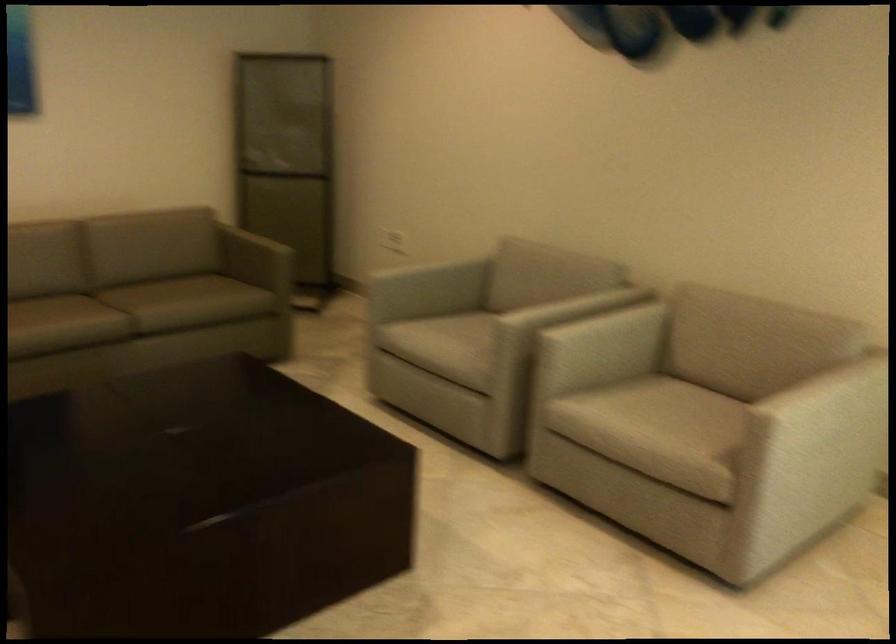
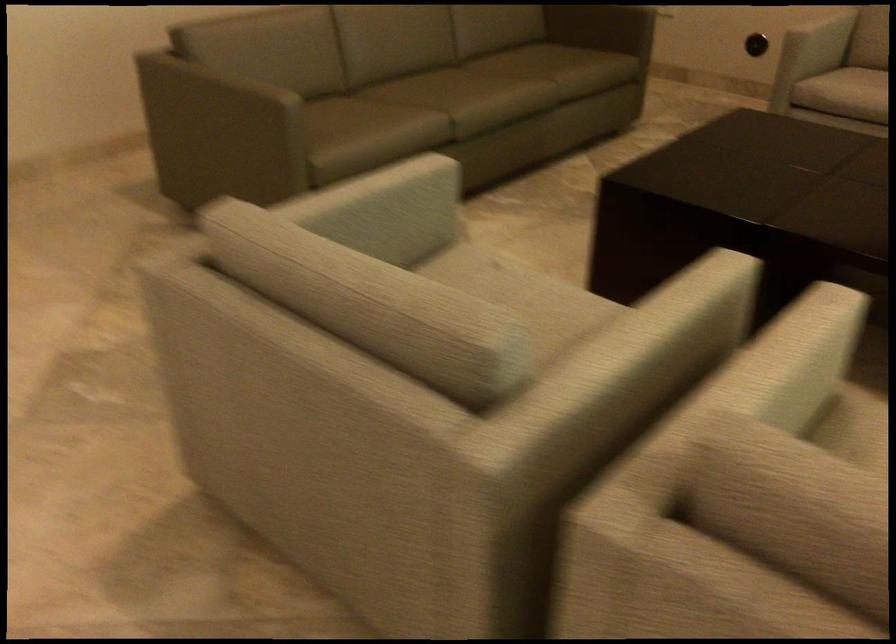
Where in the second image is the point corresponding to point 433,279 from the first image?

(821, 35)